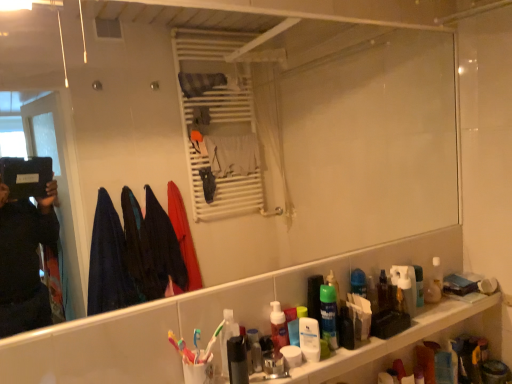
At what (x,y) coordinates should I click in order to perform the action: click on vacant area on top of translucent plastic shelf at lower right (from a real-world perspective). Please return your answer as a coordinate pair (x, y). This screenshot has height=384, width=512. Looking at the image, I should click on (360, 332).